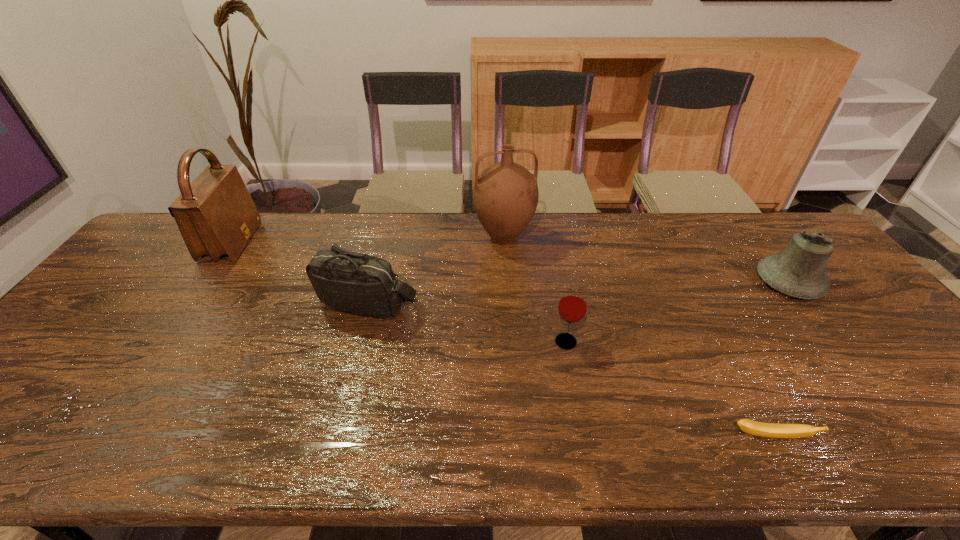
Locate an element on the screen. empty space between the second nearest object and the nearer shoulder bag is located at coordinates (467, 322).

The image size is (960, 540). Find the location of `object that stands as the fourth closest to the right shoulder bag`. object that stands as the fourth closest to the right shoulder bag is located at coordinates (774, 430).

Choose which object is the fifth nearest neighbor to the pitcher. Please provide its 2D coordinates. Your answer should be formatted as a tuple, i.e. [(x, y)], where the tuple contains the x and y coordinates of a point satisfying the conditions above.

[(216, 216)]

This screenshot has width=960, height=540. I want to click on blank space that satisfies the following two spatial constraints: 1. on the front flap of the rightmost object; 2. on the left side of the taller shoulder bag, so click(x=204, y=282).

Image resolution: width=960 pixels, height=540 pixels. In order to click on vacant space that satisfies the following two spatial constraints: 1. on the front flap of the leftmost object; 2. on the right side of the rightmost object in this screenshot , I will do `click(204, 282)`.

This screenshot has height=540, width=960. I want to click on vacant region that satisfies the following two spatial constraints: 1. on the back side of the fourth object from left to right; 2. on the right side of the bell, so click(555, 282).